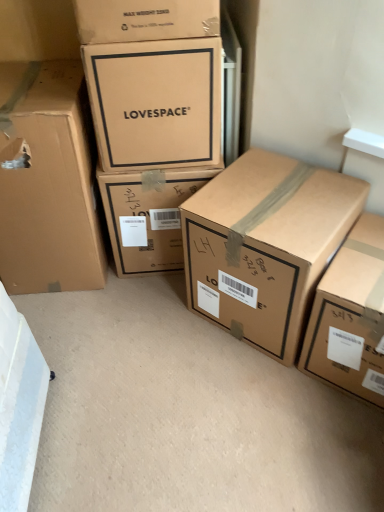
Question: Does matte cardboard box at upper center, the fourth box positioned from the right, have a lesser width compared to matte cardboard box at left, the 5th box in the right-to-left sequence?

Choices:
 (A) no
 (B) yes

Answer: (B)

Question: Does matte cardboard box at upper center, the fourth box positioned from the right, have a lesser height compared to matte cardboard box at left, the 5th box in the right-to-left sequence?

Choices:
 (A) yes
 (B) no

Answer: (A)

Question: Is matte cardboard box at upper center, placed as the second box when sorted from left to right, at the right side of matte cardboard box at left, the 5th box in the right-to-left sequence?

Choices:
 (A) no
 (B) yes

Answer: (B)

Question: Considering the relative sizes of matte cardboard box at upper center, the fourth box positioned from the right, and matte cardboard box at left, marked as the 1th box in a left-to-right arrangement, in the image provided, is matte cardboard box at upper center, the fourth box positioned from the right, bigger than matte cardboard box at left, marked as the 1th box in a left-to-right arrangement,?

Choices:
 (A) no
 (B) yes

Answer: (A)

Question: Can you confirm if matte cardboard box at upper center, placed as the second box when sorted from left to right, is positioned to the left of matte cardboard box at left, the 5th box in the right-to-left sequence?

Choices:
 (A) yes
 (B) no

Answer: (B)

Question: Is matte cardboard box at upper center, the fourth box positioned from the right, facing towards matte cardboard box at left, the 5th box in the right-to-left sequence?

Choices:
 (A) yes
 (B) no

Answer: (B)

Question: Does matte cardboard box at left, the 5th box in the right-to-left sequence, have a greater height compared to brown cardboard box at center, the 2th box in the right-to-left sequence?

Choices:
 (A) no
 (B) yes

Answer: (B)

Question: From a real-world perspective, is matte cardboard box at left, the 5th box in the right-to-left sequence, beneath brown cardboard box at center, which ranks as the 4th box in left-to-right order?

Choices:
 (A) no
 (B) yes

Answer: (A)

Question: Can brown cardboard box at center, the 2th box in the right-to-left sequence, be found inside matte cardboard box at left, marked as the 1th box in a left-to-right arrangement?

Choices:
 (A) yes
 (B) no

Answer: (B)

Question: From the image's perspective, is matte cardboard box at left, the 5th box in the right-to-left sequence, located beneath brown cardboard box at center, the 2th box in the right-to-left sequence?

Choices:
 (A) yes
 (B) no

Answer: (B)

Question: Is matte cardboard box at left, marked as the 1th box in a left-to-right arrangement, in front of brown cardboard box at center, which ranks as the 4th box in left-to-right order?

Choices:
 (A) no
 (B) yes

Answer: (A)

Question: Can you confirm if matte cardboard box at left, the 5th box in the right-to-left sequence, is wider than brown cardboard box at center, which ranks as the 4th box in left-to-right order?

Choices:
 (A) no
 (B) yes

Answer: (B)

Question: Is matte cardboard box at upper center, the fourth box positioned from the right, closer to camera compared to matte cardboard box at center, the 3th box in the right-to-left sequence?

Choices:
 (A) no
 (B) yes

Answer: (B)